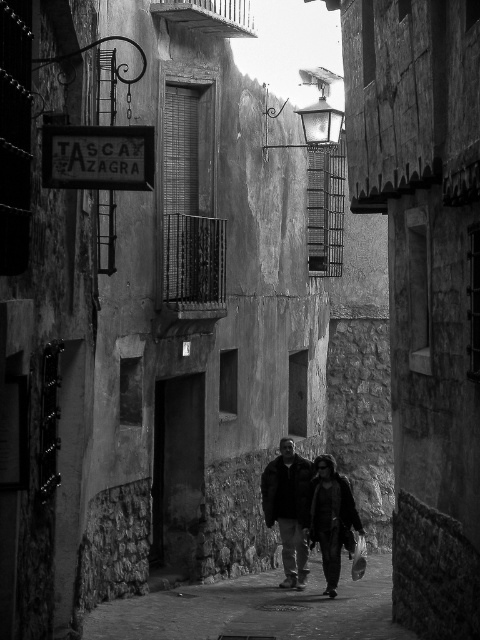
Question: Does dark fabric jacket at center have a smaller size compared to dark brown leather jacket at center?

Choices:
 (A) yes
 (B) no

Answer: (B)

Question: Can you confirm if dark fabric jacket at center is positioned below dark brown leather jacket at center?

Choices:
 (A) no
 (B) yes

Answer: (A)

Question: Can you confirm if smooth stone pavement at center is positioned below dark brown leather jacket at center?

Choices:
 (A) yes
 (B) no

Answer: (A)

Question: Which of the following is the closest to the observer?

Choices:
 (A) smooth stone pavement at center
 (B) dark brown leather jacket at center

Answer: (A)

Question: Which point is farther from the camera taking this photo?

Choices:
 (A) (294, 500)
 (B) (154, 605)

Answer: (A)

Question: Which point is closer to the camera?

Choices:
 (A) dark fabric jacket at center
 (B) smooth stone pavement at center

Answer: (B)